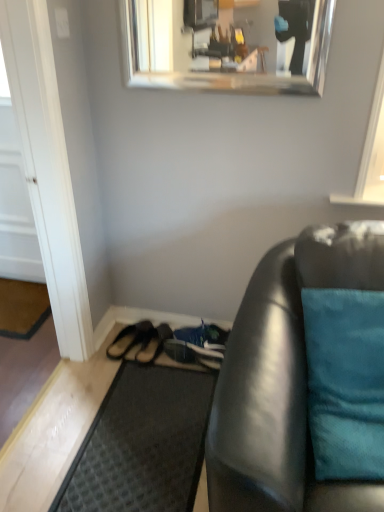
I want to click on brown leather sandals at lower left, acting as the 1th footwear starting from the left, so click(128, 339).

What do you see at coordinates (15, 200) in the screenshot?
I see `white glossy door at left` at bounding box center [15, 200].

Where is `white glossy door at left`? This screenshot has height=512, width=384. white glossy door at left is located at coordinates (15, 200).

This screenshot has width=384, height=512. Describe the element at coordinates (345, 382) in the screenshot. I see `teal fabric pillow at right` at that location.

This screenshot has width=384, height=512. I want to click on dark gray textured mat at left, which is the 2th doormat from front to back, so click(x=22, y=308).

This screenshot has width=384, height=512. What do you see at coordinates (153, 343) in the screenshot?
I see `brown suede sandals at lower center, arranged as the second footwear when viewed from the left` at bounding box center [153, 343].

Identify the location of white wood door at lower left. Image resolution: width=384 pixels, height=512 pixels. (47, 168).

The width and height of the screenshot is (384, 512). I want to click on silver metallic mirror at upper center, so [x=227, y=44].

Which object is thinner, dark gray textured mat at left, the 1th doormat in the left-to-right sequence, or black rubber doormat at lower center, marked as the 1th doormat in a right-to-left arrangement?

dark gray textured mat at left, the 1th doormat in the left-to-right sequence.

From the image's perspective, does dark gray textured mat at left, which is the 2th doormat from front to back, appear lower than black rubber doormat at lower center, which is the 1th doormat from front to back?

Incorrect, from the image's perspective, dark gray textured mat at left, which is the 2th doormat from front to back, is higher than black rubber doormat at lower center, which is the 1th doormat from front to back.

Is dark gray textured mat at left, positioned as the 2th doormat in bottom-to-top order, facing away from black rubber doormat at lower center, the 2th doormat when ordered from left to right?

No, dark gray textured mat at left, positioned as the 2th doormat in bottom-to-top order, is not facing the opposite direction of black rubber doormat at lower center, the 2th doormat when ordered from left to right.

Can black rubber doormat at lower center, which is the 1th doormat from front to back, be found inside dark gray textured mat at left, which is counted as the second doormat, starting from the right?

No, black rubber doormat at lower center, which is the 1th doormat from front to back, is not inside dark gray textured mat at left, which is counted as the second doormat, starting from the right.

From a real-world perspective, is white wood door at lower left positioned under brown suede sandals at lower center, acting as the 1th footwear starting from the right, based on gravity?

No, from a real-world perspective, white wood door at lower left is not beneath brown suede sandals at lower center, acting as the 1th footwear starting from the right.

Can you confirm if white wood door at lower left is thinner than brown suede sandals at lower center, arranged as the second footwear when viewed from the left?

Indeed, white wood door at lower left has a lesser width compared to brown suede sandals at lower center, arranged as the second footwear when viewed from the left.

Which point is more forward, [61,329] or [149,362]?

The point [61,329] is closer.

From the image's perspective, between white wood door at lower left and brown suede sandals at lower center, acting as the 1th footwear starting from the right, who is located below?

brown suede sandals at lower center, acting as the 1th footwear starting from the right, appears lower in the image.

Who is smaller, black rubber doormat at lower center, which is the second doormat from top to bottom, or white glossy door at left?

With smaller size is black rubber doormat at lower center, which is the second doormat from top to bottom.

Is white glossy door at left a part of black rubber doormat at lower center, marked as the 1th doormat in a right-to-left arrangement?

Actually, white glossy door at left is outside black rubber doormat at lower center, marked as the 1th doormat in a right-to-left arrangement.

From the image's perspective, which is above, black rubber doormat at lower center, which ranks as the 2th doormat in back-to-front order, or white glossy door at left?

From the image's view, white glossy door at left is above.

Can you confirm if black rubber doormat at lower center, marked as the 1th doormat in a right-to-left arrangement, is wider than white glossy door at left?

Yes, black rubber doormat at lower center, marked as the 1th doormat in a right-to-left arrangement, is wider than white glossy door at left.

Consider the image. Does teal fabric pillow at right appear on the left side of white glossy door at left?

In fact, teal fabric pillow at right is to the right of white glossy door at left.

Is point (330, 305) more distant than point (25, 237)?

No.

Based on the photo, which is in front, teal fabric pillow at right or white glossy door at left?

teal fabric pillow at right is closer to the camera.

Which object is thinner, black rubber doormat at lower center, which ranks as the 2th doormat in back-to-front order, or dark gray textured mat at left, the first doormat viewed from the back?

dark gray textured mat at left, the first doormat viewed from the back, is thinner.

Does black rubber doormat at lower center, the 2th doormat when ordered from left to right, have a smaller size compared to dark gray textured mat at left, the 1th doormat positioned from the top?

No, black rubber doormat at lower center, the 2th doormat when ordered from left to right, is not smaller than dark gray textured mat at left, the 1th doormat positioned from the top.

From the image's perspective, is black rubber doormat at lower center, marked as the 1th doormat in a right-to-left arrangement, beneath dark gray textured mat at left, which is counted as the second doormat, starting from the right?

Correct, black rubber doormat at lower center, marked as the 1th doormat in a right-to-left arrangement, appears lower than dark gray textured mat at left, which is counted as the second doormat, starting from the right, in the image.

Who is taller, black rubber doormat at lower center, which ranks as the 2th doormat in back-to-front order, or dark gray textured mat at left, which is counted as the second doormat, starting from the right?

dark gray textured mat at left, which is counted as the second doormat, starting from the right.

Identify the location of footwear above the brown suede sandals at lower center, acting as the 1th footwear starting from the right (from the image's perspective). (128, 339).

Can you tell me how much brown suede sandals at lower center, acting as the 1th footwear starting from the right, and brown leather sandals at lower left, acting as the 1th footwear starting from the left, differ in facing direction?

They differ by 3.36 degrees in their facing directions.

Is brown suede sandals at lower center, acting as the 1th footwear starting from the right, not close to brown leather sandals at lower left, which is counted as the 2th footwear, starting from the right?

Actually, brown suede sandals at lower center, acting as the 1th footwear starting from the right, and brown leather sandals at lower left, which is counted as the 2th footwear, starting from the right, are a little close together.

From the image's perspective, which object appears higher, brown suede sandals at lower center, arranged as the second footwear when viewed from the left, or brown leather sandals at lower left, which is counted as the 2th footwear, starting from the right?

brown leather sandals at lower left, which is counted as the 2th footwear, starting from the right, is shown above in the image.

Is brown leather sandals at lower left, which is counted as the 2th footwear, starting from the right, bigger than dark gray textured mat at left, which is counted as the second doormat, starting from the right?

Incorrect, brown leather sandals at lower left, which is counted as the 2th footwear, starting from the right, is not larger than dark gray textured mat at left, which is counted as the second doormat, starting from the right.

At what (x,y) coordinates should I click in order to perform the action: click on the 1st footwear in front when counting from the dark gray textured mat at left, the first doormat viewed from the back. Please return your answer as a coordinate pair (x, y). The width and height of the screenshot is (384, 512). Looking at the image, I should click on (128, 339).

Does brown leather sandals at lower left, which is counted as the 2th footwear, starting from the right, lie in front of dark gray textured mat at left, positioned as the 2th doormat in bottom-to-top order?

That is True.

From the image's perspective, which is below, brown leather sandals at lower left, which is counted as the 2th footwear, starting from the right, or dark gray textured mat at left, which is counted as the second doormat, starting from the right?

brown leather sandals at lower left, which is counted as the 2th footwear, starting from the right, appears lower in the image.

The width and height of the screenshot is (384, 512). In order to click on doormat above the black rubber doormat at lower center, the 2th doormat when ordered from left to right (from a real-world perspective) in this screenshot , I will do `click(22, 308)`.

At what (x,y) coordinates should I click in order to perform the action: click on the 2nd footwear to the right of the white wood door at lower left, counting from the anchor's position. Please return your answer as a coordinate pair (x, y). Looking at the image, I should click on (153, 343).

Which object lies nearer to the anchor point black rubber doormat at lower center, which ranks as the 2th doormat in back-to-front order, silver metallic mirror at upper center or brown leather sandals at lower left, acting as the 1th footwear starting from the left?

The object closer to black rubber doormat at lower center, which ranks as the 2th doormat in back-to-front order, is brown leather sandals at lower left, acting as the 1th footwear starting from the left.

Considering their positions, is dark gray textured mat at left, positioned as the 2th doormat in bottom-to-top order, positioned further to brown suede sandals at lower center, arranged as the second footwear when viewed from the left, than white wood door at lower left?

dark gray textured mat at left, positioned as the 2th doormat in bottom-to-top order, is further to brown suede sandals at lower center, arranged as the second footwear when viewed from the left.

Considering their positions, is black rubber doormat at lower center, the 2th doormat when ordered from left to right, positioned further to brown suede sandals at lower center, acting as the 1th footwear starting from the right, than silver metallic mirror at upper center?

silver metallic mirror at upper center.

Based on their spatial positions, is silver metallic mirror at upper center or brown leather sandals at lower left, which is counted as the 2th footwear, starting from the right, further from white glossy door at left?

The object further to white glossy door at left is silver metallic mirror at upper center.

From the image, which object appears to be farther from dark gray textured mat at left, positioned as the 2th doormat in bottom-to-top order, brown leather sandals at lower left, which is counted as the 2th footwear, starting from the right, or brown suede sandals at lower center, acting as the 1th footwear starting from the right?

Among the two, brown suede sandals at lower center, acting as the 1th footwear starting from the right, is located further to dark gray textured mat at left, positioned as the 2th doormat in bottom-to-top order.

Looking at the image, which one is located further to white wood door at lower left, brown suede sandals at lower center, arranged as the second footwear when viewed from the left, or dark gray textured mat at left, the 1th doormat in the left-to-right sequence?

brown suede sandals at lower center, arranged as the second footwear when viewed from the left, lies further to white wood door at lower left than the other object.

Looking at the image, which one is located closer to black rubber doormat at lower center, which is the second doormat from top to bottom, teal fabric pillow at right or silver metallic mirror at upper center?

The object closer to black rubber doormat at lower center, which is the second doormat from top to bottom, is teal fabric pillow at right.

Looking at the image, which one is located further to brown suede sandals at lower center, arranged as the second footwear when viewed from the left, white wood door at lower left or teal fabric pillow at right?

The object further to brown suede sandals at lower center, arranged as the second footwear when viewed from the left, is teal fabric pillow at right.

Where is `footwear that lies between white glossy door at left and brown suede sandals at lower center, arranged as the second footwear when viewed from the left, from top to bottom`? footwear that lies between white glossy door at left and brown suede sandals at lower center, arranged as the second footwear when viewed from the left, from top to bottom is located at coordinates (128, 339).

Identify the location of window frame located between white glossy door at left and teal fabric pillow at right in the left-right direction. (47, 168).

I want to click on doormat between dark gray textured mat at left, the 1th doormat in the left-to-right sequence, and teal fabric pillow at right, in the horizontal direction, so click(x=142, y=444).

The height and width of the screenshot is (512, 384). In order to click on door between silver metallic mirror at upper center and brown leather sandals at lower left, which is counted as the 2th footwear, starting from the right, from top to bottom in this screenshot , I will do `click(15, 200)`.